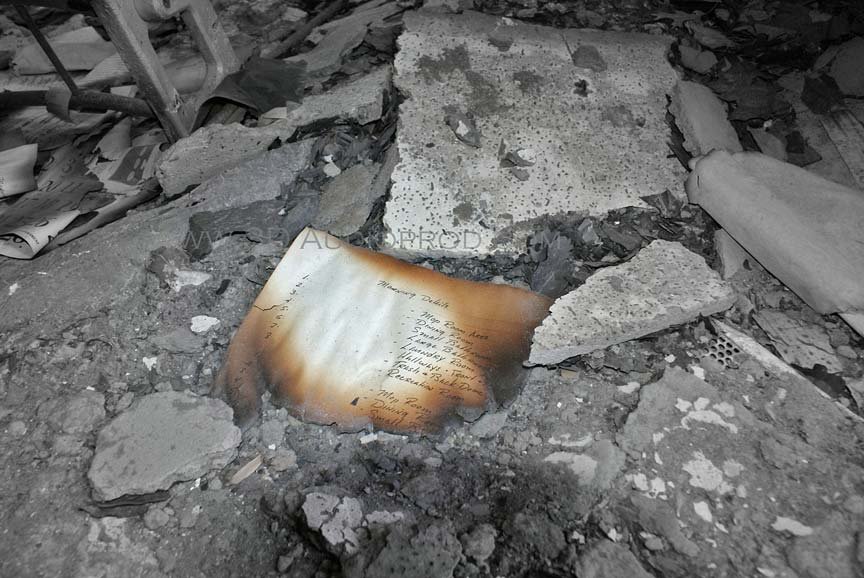
Locate an element on the screen. mop room is located at coordinates (384, 392), (420, 405).